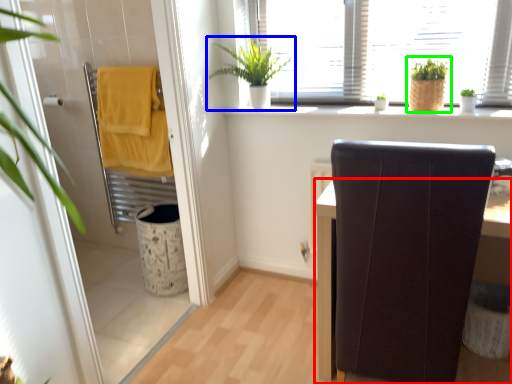
Question: Which object is positioned farthest from furniture (highlighted by a red box)? Select from houseplant (highlighted by a blue box) and houseplant (highlighted by a green box).

Choices:
 (A) houseplant
 (B) houseplant

Answer: (A)